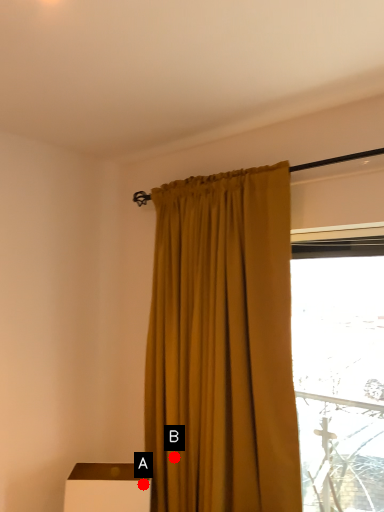
Question: Two points are circled on the image, labeled by A and B beside each circle. Which point is closer to the camera taking this photo?

Choices:
 (A) A is closer
 (B) B is closer

Answer: (A)